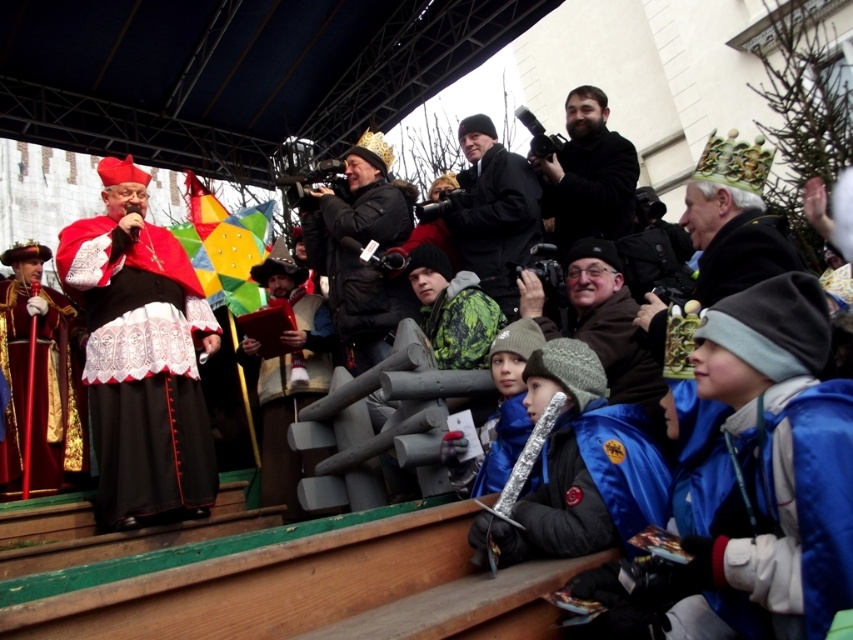
Question: Can you confirm if bearded man with camera at upper center is wider than velvet red book at center?

Choices:
 (A) yes
 (B) no

Answer: (A)

Question: Which point appears farthest from the camera in this image?

Choices:
 (A) (57, 445)
 (B) (387, 214)
 (C) (310, 316)

Answer: (C)

Question: Which point is closer to the camera taking this photo?

Choices:
 (A) (643, 513)
 (B) (181, 506)

Answer: (A)

Question: In this image, where is black matte crown at center located relative to velvet red book at center?

Choices:
 (A) left
 (B) right

Answer: (B)

Question: Is matte black camera at center thinner than velvet red book at center?

Choices:
 (A) no
 (B) yes

Answer: (B)

Question: Among these objects, which one is nearest to the camera?

Choices:
 (A) silver metallic sword at lower center
 (B) blue fleece jacket at lower right

Answer: (B)